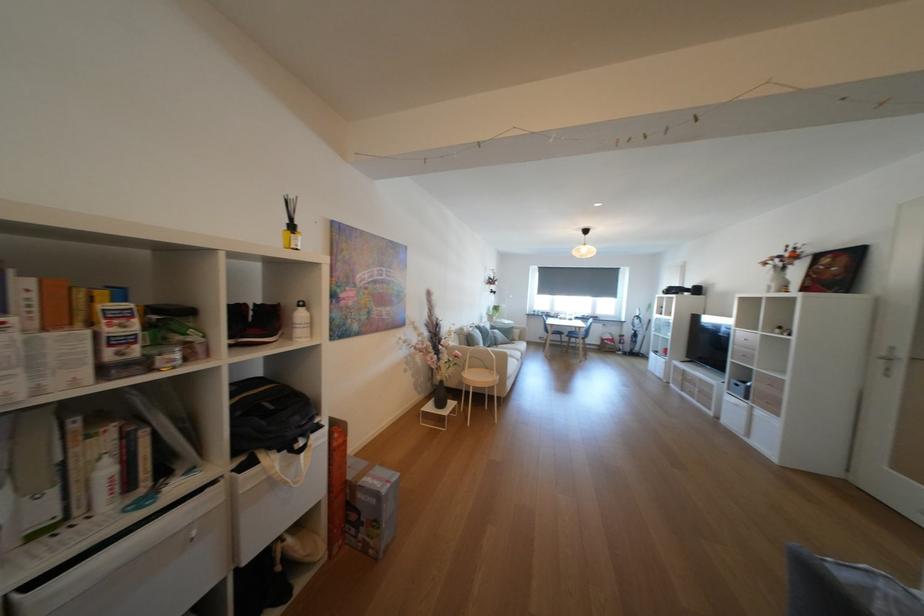
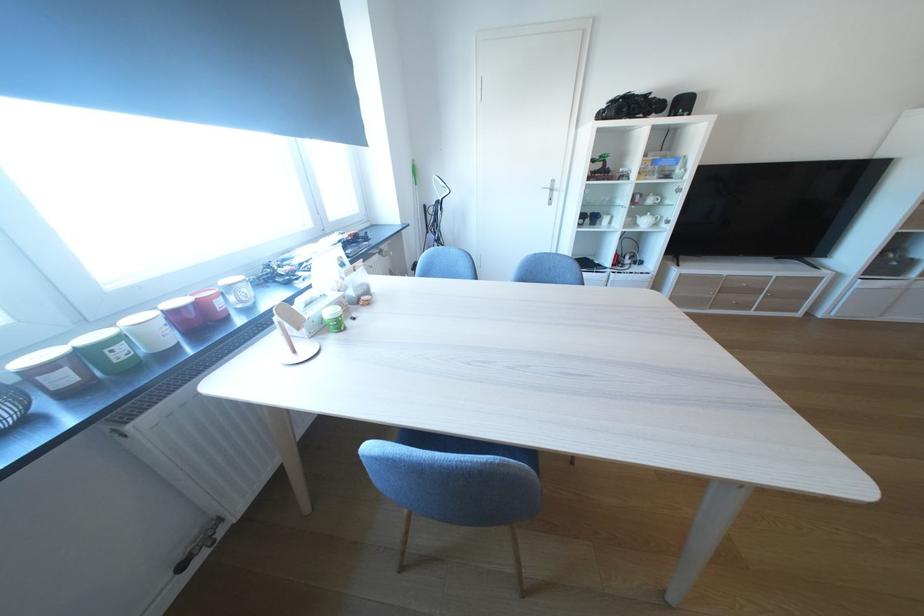
Find the pixel in the second image that matches point (561, 315) in the first image.

(129, 354)